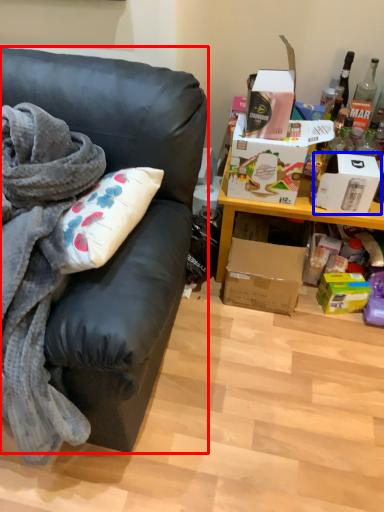
Question: Among these objects, which one is farthest to the camera, studio couch (highlighted by a red box) or box (highlighted by a blue box)?

Choices:
 (A) studio couch
 (B) box

Answer: (B)